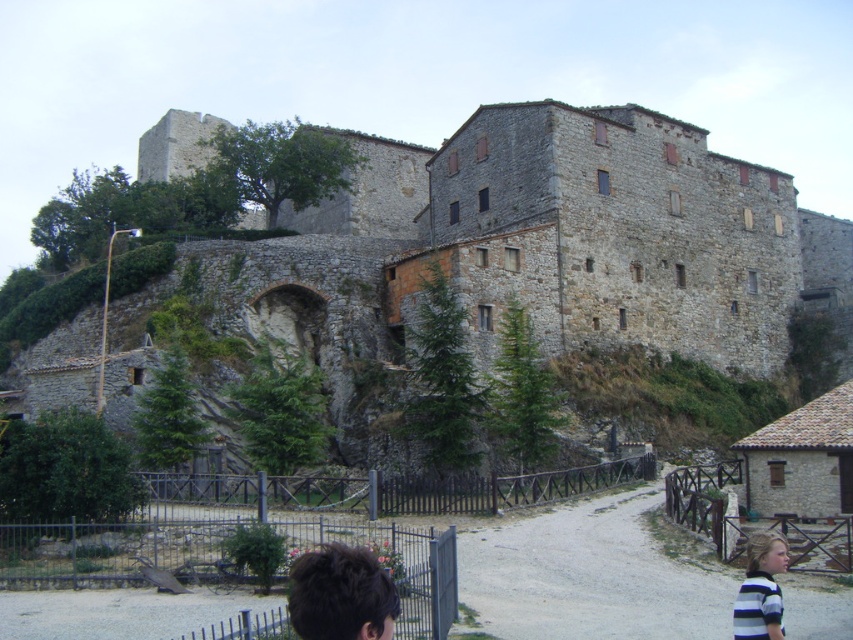
You are a photographer standing at the base of the hill, looking up at the historic stone building. You notice two people on the pathway leading to the building. One has dark brown hair at lower center and another wearing a striped fabric shirt at lower right. Which of these two people appears narrower from your perspective?

The dark brown hair at lower center appears narrower than the striped fabric shirt at lower right from your perspective.

You are a tour guide leading a group to the stone castle at upper center. One of your tourists, who has dark brown hair at lower center, is lagging behind. If the average walking speed is 3 feet per second, how many seconds will it take for the tourist to reach the castle?

The distance between the stone castle at upper center and dark brown hair at lower center is 144.65 feet. At an average walking speed of 3 feet per second, the tourist will take approximately 48.22 seconds to reach the castle.